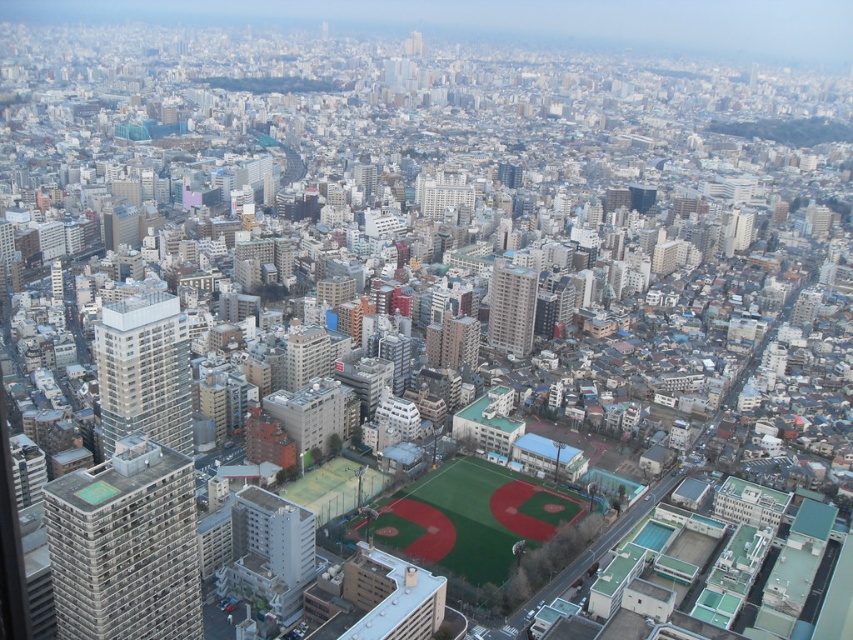
Is gray concrete building at lower left to the left of matte gray building at center from the viewer's perspective?

Correct, you'll find gray concrete building at lower left to the left of matte gray building at center.

Who is more distant from viewer, [187,499] or [521,300]?

Point [521,300]

Between point (103, 552) and point (520, 340), which one is positioned behind?

The point (520, 340) is more distant.

In order to click on gray concrete building at lower left in this screenshot , I will do [125, 547].

Who is shorter, beige concrete building at center-left or gray concrete building at center?

gray concrete building at center

How distant is beige concrete building at center-left from gray concrete building at center?

They are 160.81 feet apart.

Which is in front, point (125, 362) or point (296, 348)?

Point (125, 362) is more forward.

I want to click on beige concrete building at center-left, so click(143, 371).

Between green artificial turf baseball field at center and matte gray building at center, which one is positioned higher?

matte gray building at center is higher up.

How distant is green artificial turf baseball field at center from matte gray building at center?

A distance of 286.27 feet exists between green artificial turf baseball field at center and matte gray building at center.

Describe the element at coordinates (471, 516) in the screenshot. I see `green artificial turf baseball field at center` at that location.

This screenshot has width=853, height=640. What are the coordinates of `green artificial turf baseball field at center` in the screenshot? It's located at click(x=471, y=516).